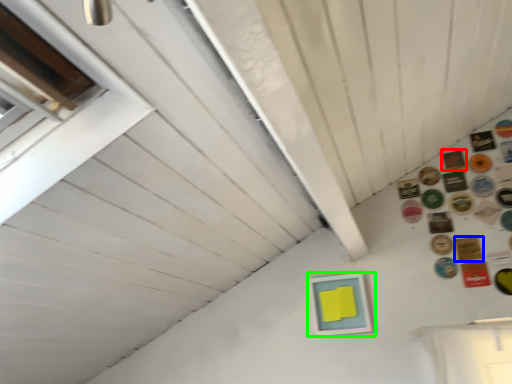
Question: Which object is positioned farthest from button (highlighted by a red box)? Select from button (highlighted by a blue box) and picture frame (highlighted by a green box).

Choices:
 (A) button
 (B) picture frame

Answer: (B)